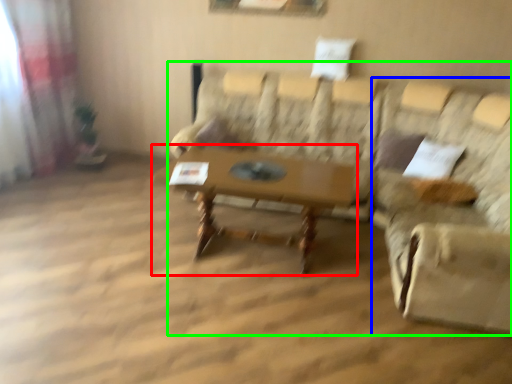
Question: Based on their relative distances, which object is farther from table (highlighted by a red box)? Choose from swivel chair (highlighted by a blue box) and studio couch (highlighted by a green box).

Choices:
 (A) swivel chair
 (B) studio couch

Answer: (B)